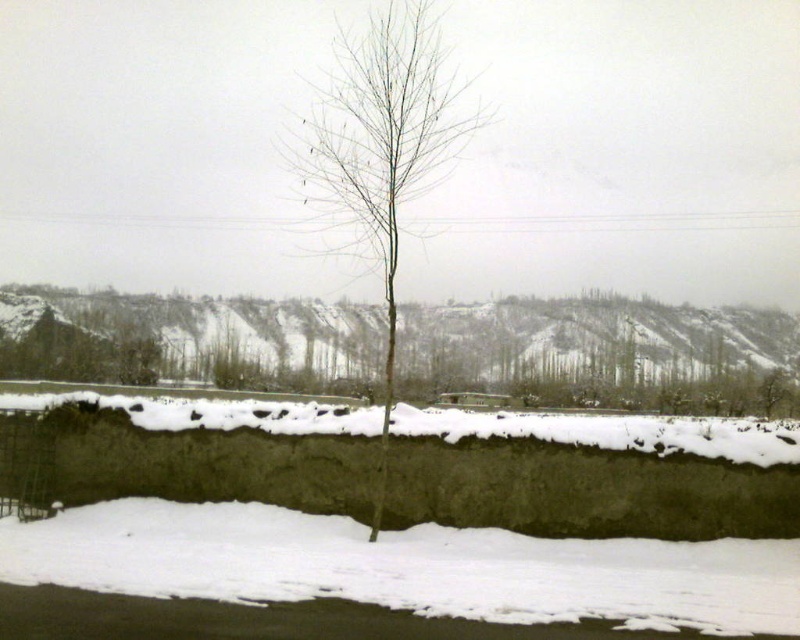
Question: Which object appears farthest from the camera in this image?

Choices:
 (A) bare wood tree at center
 (B) bare branches at center

Answer: (B)

Question: Does bare branches at center appear over bare wood tree at center?

Choices:
 (A) yes
 (B) no

Answer: (B)

Question: In this image, where is bare branches at center located relative to bare wood tree at center?

Choices:
 (A) right
 (B) left

Answer: (A)

Question: Among these objects, which one is farthest from the camera?

Choices:
 (A) bare branches at center
 (B) white powdery snow at lower center
 (C) bare wood tree at center

Answer: (A)

Question: Which point is farther to the camera?

Choices:
 (A) white powdery snow at lower center
 (B) bare wood tree at center

Answer: (B)

Question: Considering the relative positions of white powdery snow at lower center and bare branches at center in the image provided, where is white powdery snow at lower center located with respect to bare branches at center?

Choices:
 (A) above
 (B) below

Answer: (B)